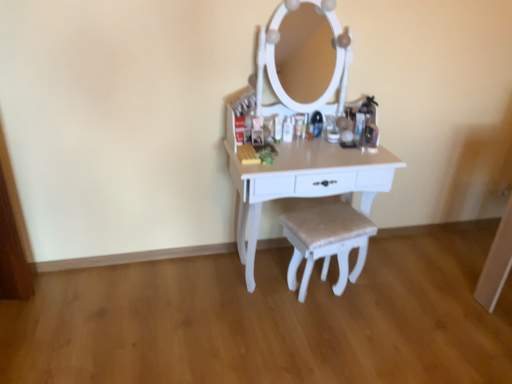
Identify the location of vacant space situated on the left part of white painted wood table at center. Image resolution: width=512 pixels, height=384 pixels. (186, 294).